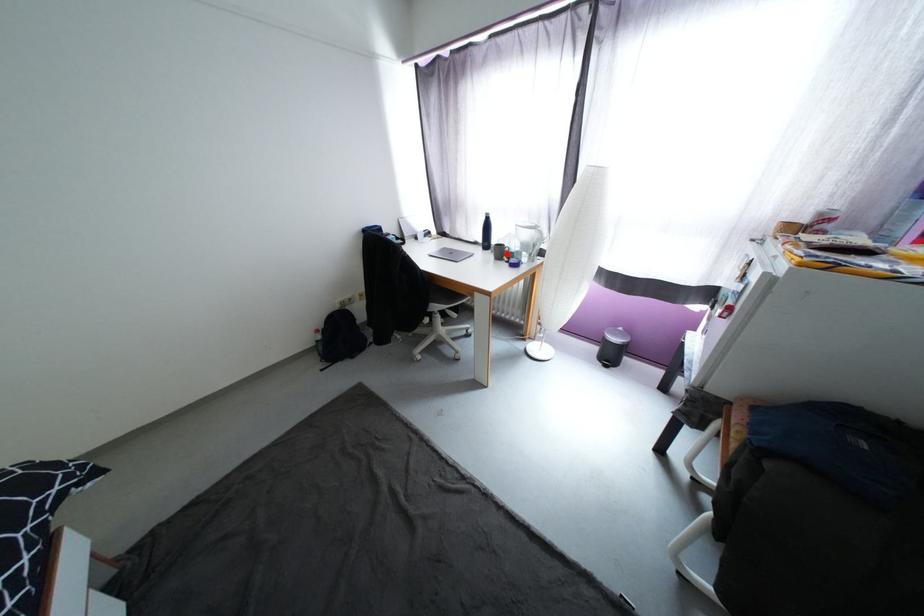
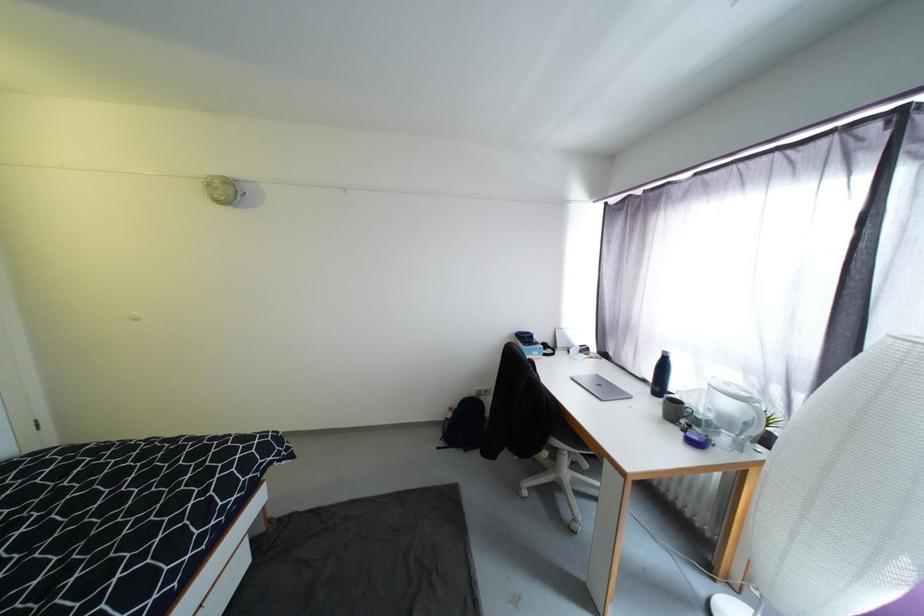
The point at the highlighted location is marked in the first image. Where is the corresponding point in the second image?

(683, 413)